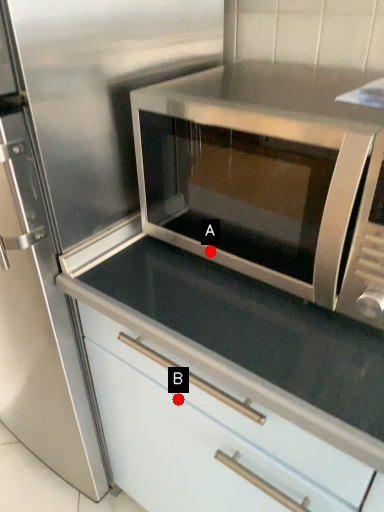
Question: Two points are circled on the image, labeled by A and B beside each circle. Which of the following is the closest to the observer?

Choices:
 (A) A is closer
 (B) B is closer

Answer: (A)